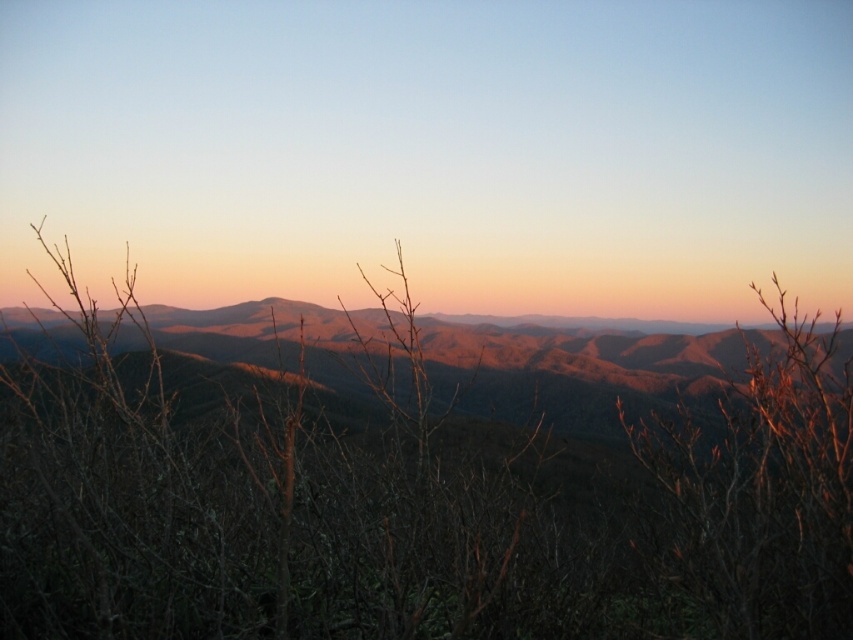
You are standing at the point marked as point (413,515) in the image. What do you see directly in front of you?

You see brown dry branches at center directly in front of you at point (413,515).

You are an artist sketching this landscape and want to ensure proper perspective. Which object, the brown dry branches at center or the brown matte mountain range at center, should appear smaller in your drawing?

The brown dry branches at center should appear smaller in your drawing because they have a lesser height compared to the brown matte mountain range at center.